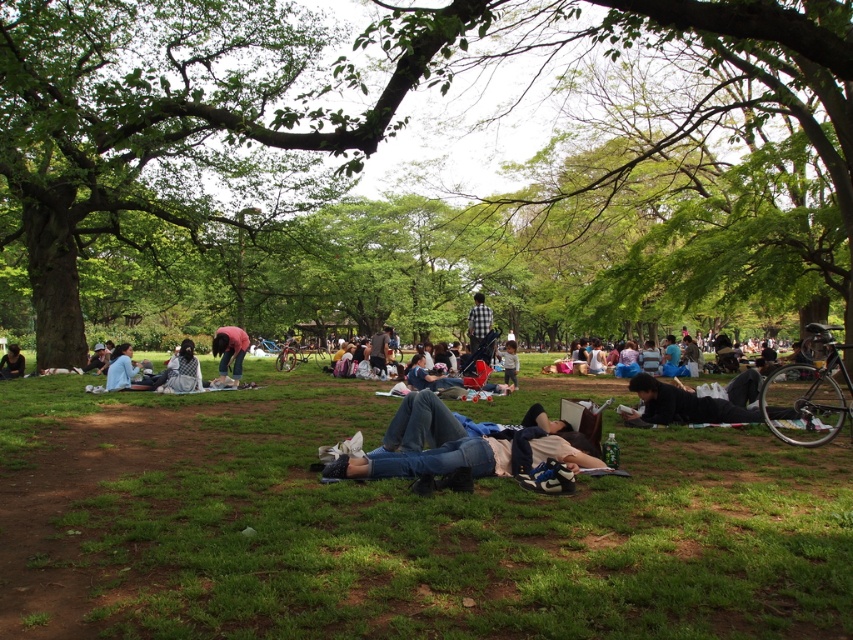
Question: Which of the following is the closest to the observer?

Choices:
 (A) checkered fabric shirt at center
 (B) green leafy tree at center

Answer: (B)

Question: Can you confirm if light blue shirt at lower left is positioned to the right of light brown fabric jacket at center?

Choices:
 (A) yes
 (B) no

Answer: (B)

Question: Is black matte jacket at lower right to the left of white lace dress at center from the viewer's perspective?

Choices:
 (A) no
 (B) yes

Answer: (A)

Question: Does green grass at center lie in front of light blue denim jeans at center?

Choices:
 (A) yes
 (B) no

Answer: (A)

Question: Which object appears closest to the camera in this image?

Choices:
 (A) pink fabric at center
 (B) checkered fabric shirt at center

Answer: (A)

Question: Which is nearer to the light blue shirt at lower left?

Choices:
 (A) white lace dress at center
 (B) green leafy tree at center

Answer: (A)